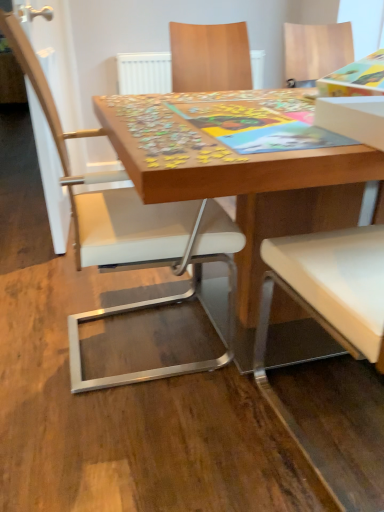
Where is `vacant area on top of wooden puzzle board at center (from a real-world perspective)`? This screenshot has height=512, width=384. vacant area on top of wooden puzzle board at center (from a real-world perspective) is located at coordinates (258, 108).